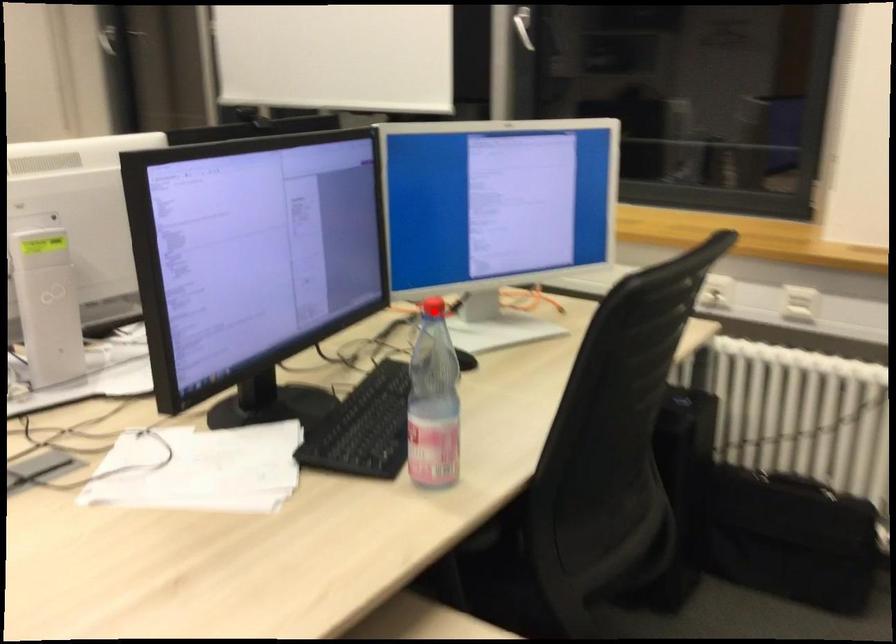
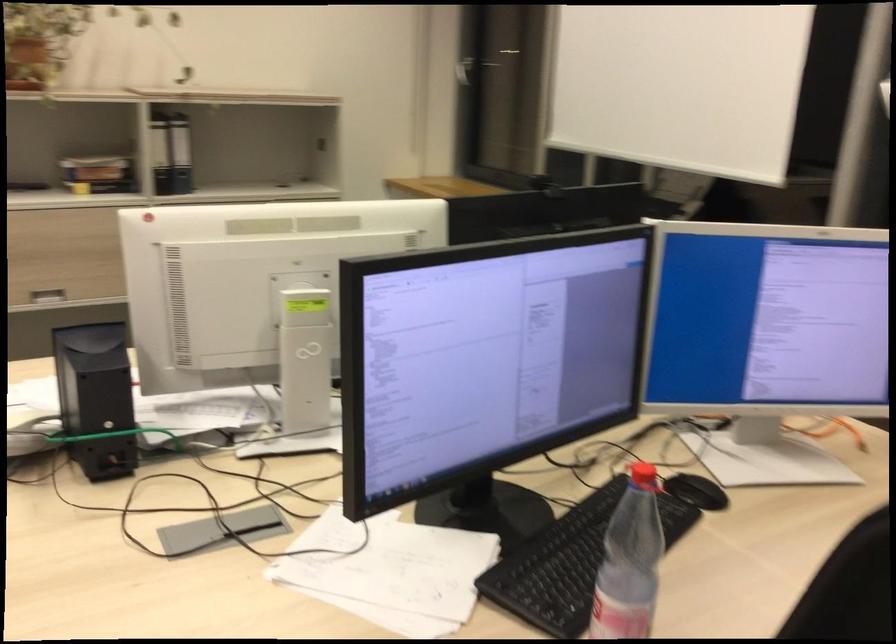
Where in the second image is the point corresponding to the highlighted location from the first image?

(642, 478)